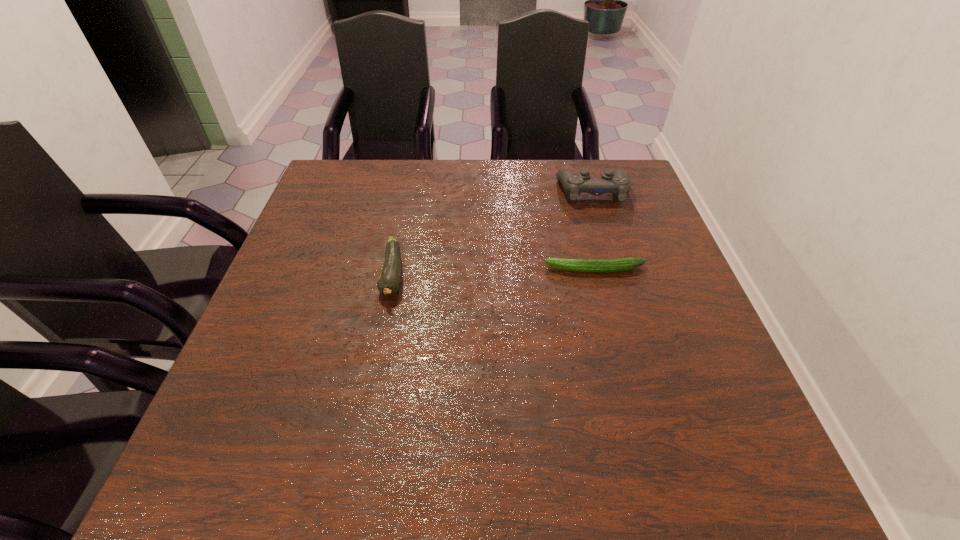
In order to click on object identified as the closest to the leftmost object in this screenshot , I will do `click(619, 264)`.

Locate which object is the second closest to the second shortest object. Please provide its 2D coordinates. Your answer should be formatted as a tuple, i.e. [(x, y)], where the tuple contains the x and y coordinates of a point satisfying the conditions above.

[(618, 183)]

Identify the location of free point that satisfies the following two spatial constraints: 1. on the front-facing side of the shorter zucchini; 2. at the blossom end of the left zucchini. (x=596, y=275).

Find the location of a particular element. The width and height of the screenshot is (960, 540). free space that satisfies the following two spatial constraints: 1. on the front-facing side of the shortest object; 2. at the blossom end of the second tallest object is located at coordinates (596, 275).

The image size is (960, 540). Identify the location of free space that satisfies the following two spatial constraints: 1. on the front-facing side of the shorter zucchini; 2. at the blossom end of the leftmost object. (596, 275).